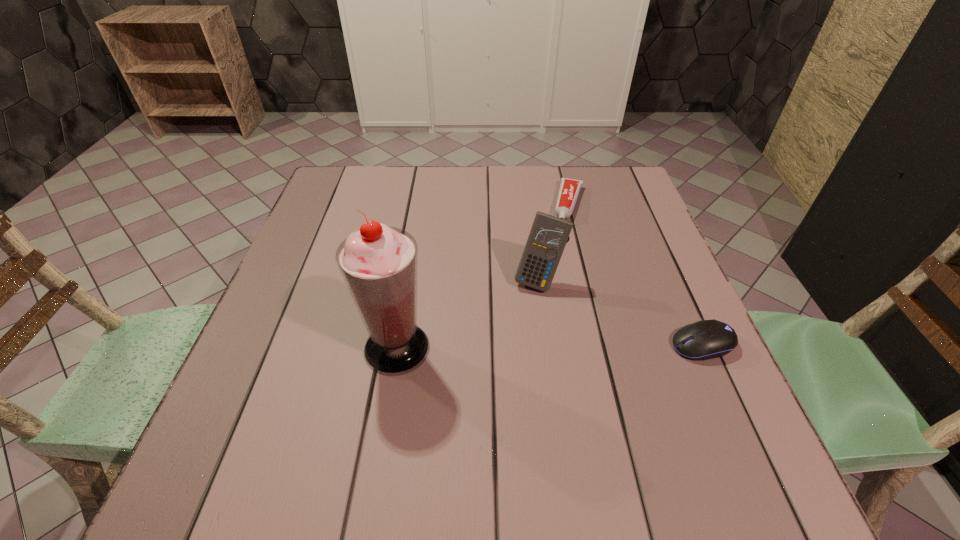
At what (x,y) coordinates should I click in order to perform the action: click on free spot on the desktop that is between the smoothie and the rightmost object and is positioned at the nozzle of the farthest object. Please return your answer as a coordinate pair (x, y). Image resolution: width=960 pixels, height=540 pixels. Looking at the image, I should click on [x=532, y=347].

Find the location of a particular element. free spot on the desktop that is between the leftmost object and the computer mouse and is positioned on the front-facing side of the calculator is located at coordinates (509, 347).